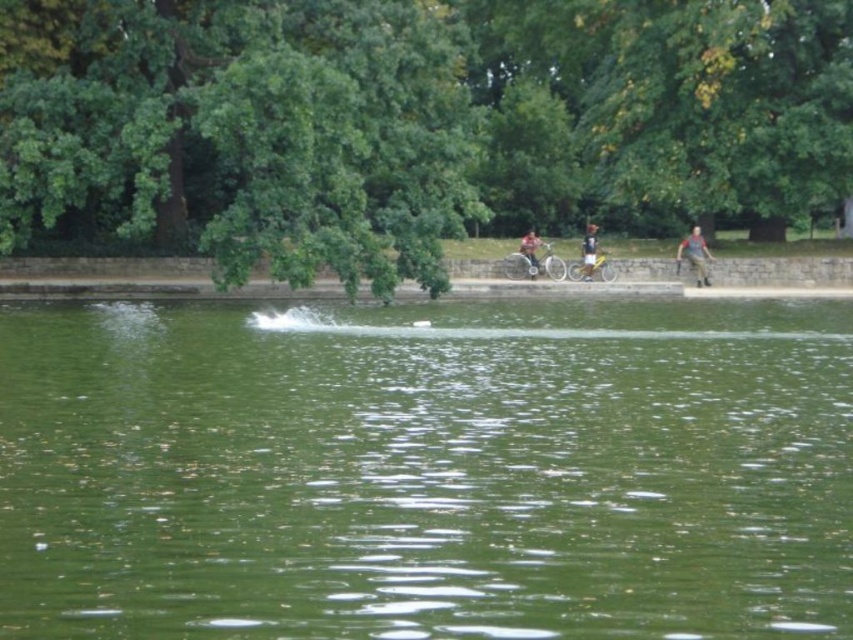
Looking at this image, does dark blue shirt at center have a greater height compared to matte black bicycle at center?

A: In fact, dark blue shirt at center may be shorter than matte black bicycle at center.

Who is taller, dark blue shirt at center or matte black bicycle at center?

Standing taller between the two is matte black bicycle at center.

At what (x,y) coordinates should I click in order to perform the action: click on dark blue shirt at center. Please return your answer as a coordinate pair (x, y). Looking at the image, I should click on (589, 250).

Is green leafy tree at upper center smaller than dark blue shirt at center?

Incorrect, green leafy tree at upper center is not smaller in size than dark blue shirt at center.

Who is more forward, (693,12) or (595,257)?

Positioned in front is point (693,12).

Locate an element on the screen. This screenshot has height=640, width=853. green leafy tree at upper center is located at coordinates (410, 125).

Does point (660, 32) come behind point (521, 253)?

That is False.

Can you confirm if green leafy tree at upper center is positioned to the right of matte black bicycle at center?

No, green leafy tree at upper center is not to the right of matte black bicycle at center.

Does point (387, 189) come farther from viewer compared to point (532, 230)?

That is False.

Where is `green leafy tree at upper center`? green leafy tree at upper center is located at coordinates (410, 125).